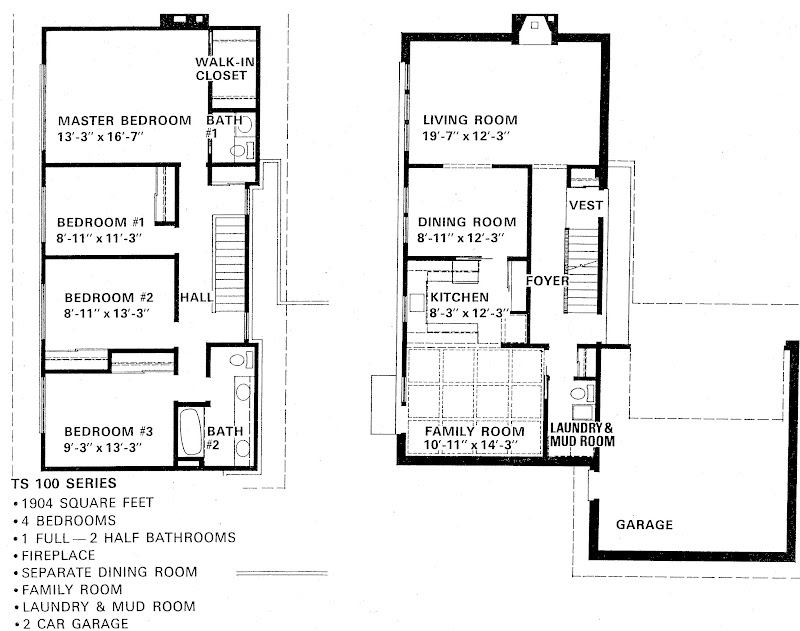
Identify the location of dining room. The image size is (800, 631). (470, 192).